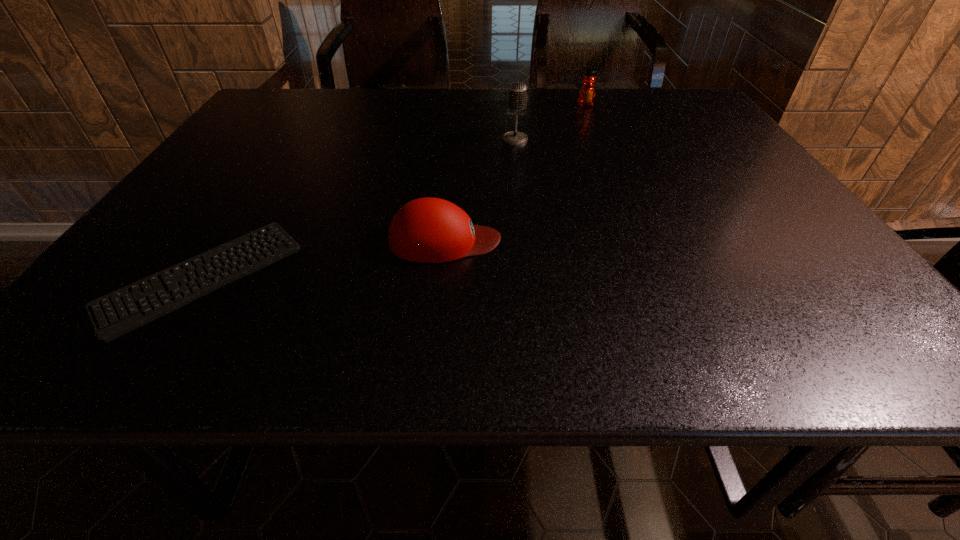
Image resolution: width=960 pixels, height=540 pixels. Identify the location of empty space between the leftmost object and the farthest object. (394, 191).

Where is `empty space between the second object from left to right and the shortest object`? The width and height of the screenshot is (960, 540). empty space between the second object from left to right and the shortest object is located at coordinates (324, 259).

Where is `free space between the second object from left to right and the leftmost object`? This screenshot has width=960, height=540. free space between the second object from left to right and the leftmost object is located at coordinates (324, 259).

Locate an element on the screen. The image size is (960, 540). free space between the third nearest object and the honey is located at coordinates (550, 122).

Identify the location of vacant space in between the second object from left to right and the rightmost object. This screenshot has width=960, height=540. (516, 173).

Find the location of a particular element. vacant area between the tallest object and the leftmost object is located at coordinates (358, 208).

The width and height of the screenshot is (960, 540). In order to click on vacant area between the computer keyboard and the third object from right to left in this screenshot , I will do `click(324, 259)`.

I want to click on free space between the rightmost object and the computer keyboard, so [x=394, y=191].

In order to click on vacant area that lies between the second farthest object and the second object from left to right in this screenshot , I will do `click(480, 190)`.

Locate an element on the screen. The width and height of the screenshot is (960, 540). free space between the leftmost object and the baseball cap is located at coordinates (324, 259).